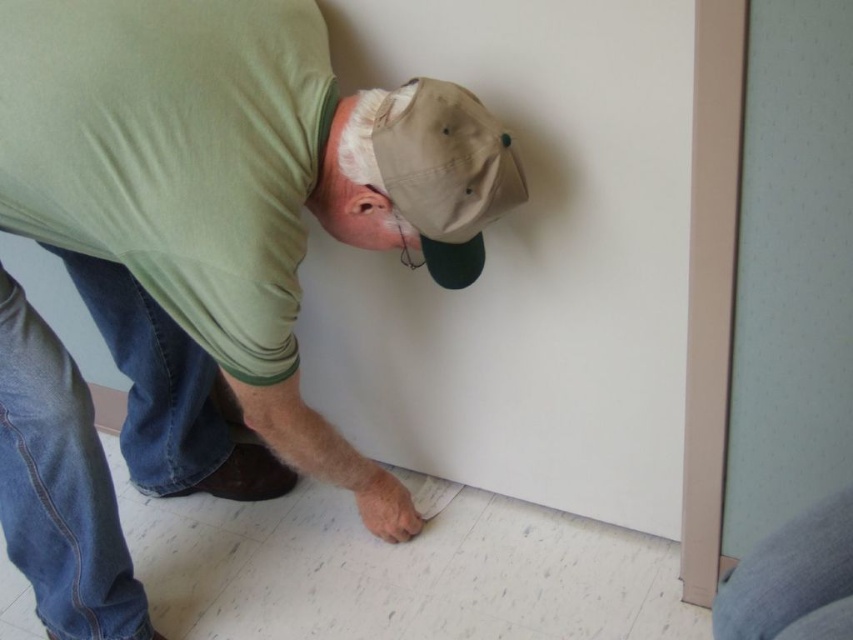
Question: From the image, what is the correct spatial relationship of green matte shirt at center in relation to gray fabric at lower right?

Choices:
 (A) above
 (B) below

Answer: (A)

Question: Which object appears farthest from the camera in this image?

Choices:
 (A) green matte shirt at center
 (B) gray fabric at lower right

Answer: (A)

Question: Does green matte shirt at center have a smaller size compared to tan fabric baseball cap at upper center?

Choices:
 (A) yes
 (B) no

Answer: (B)

Question: Which object appears closest to the camera in this image?

Choices:
 (A) green matte shirt at center
 (B) gray fabric at lower right
 (C) tan fabric baseball cap at upper center

Answer: (B)

Question: Based on their relative distances, which object is farther from the tan fabric baseball cap at upper center?

Choices:
 (A) green matte shirt at center
 (B) gray fabric at lower right

Answer: (B)

Question: Is green matte shirt at center to the right of tan fabric baseball cap at upper center from the viewer's perspective?

Choices:
 (A) yes
 (B) no

Answer: (B)